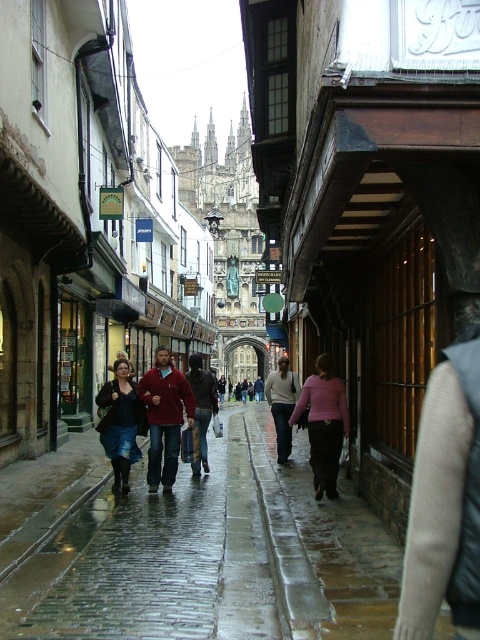
You are a fashion blogger standing in the middle of the narrow cobblestone street. You see a pink matte sweater at center and a blue denim skirt at center. Can you walk directly between them to take a photo without moving either item? Explain your reasoning.

The pink matte sweater at center and blue denim skirt at center are 18.69 meters apart. Since the distance between them is over 18 meters, you can easily walk between them to take a photo without moving either item.

You are a traveler standing at the start of the cobblestone street, wanting to reach the cathedral at the end. You notice two items on the ground ahead of you. The maroon fleece jacket at center and the pink matte sweater at center. Which item is closer to the cathedral?

The maroon fleece jacket at center is 14.26 meters from the pink matte sweater at center, so the pink matte sweater at center is closer to the cathedral since it is behind the maroon fleece jacket at center.

You are a fashion blogger visiting the historic street and spot the blue denim skirt at center and the dark brown leather jacket at center. Which item of clothing would you recommend to someone who prefers a more compact and portable option for their travel wardrobe?

The blue denim skirt at center has a smaller size compared to the dark brown leather jacket at center, so it would be more compact and portable for travel.